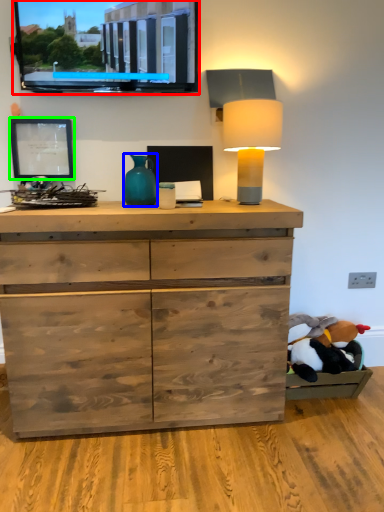
Question: Which object is the farthest from computer monitor (highlighted by a red box)? Choose among these: vase (highlighted by a blue box) or picture frame (highlighted by a green box).

Choices:
 (A) vase
 (B) picture frame

Answer: (A)